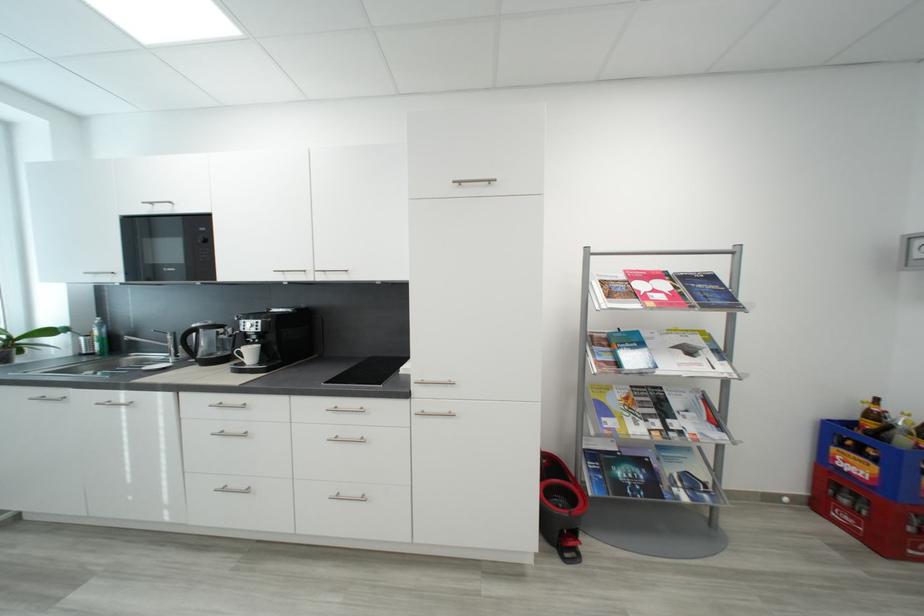
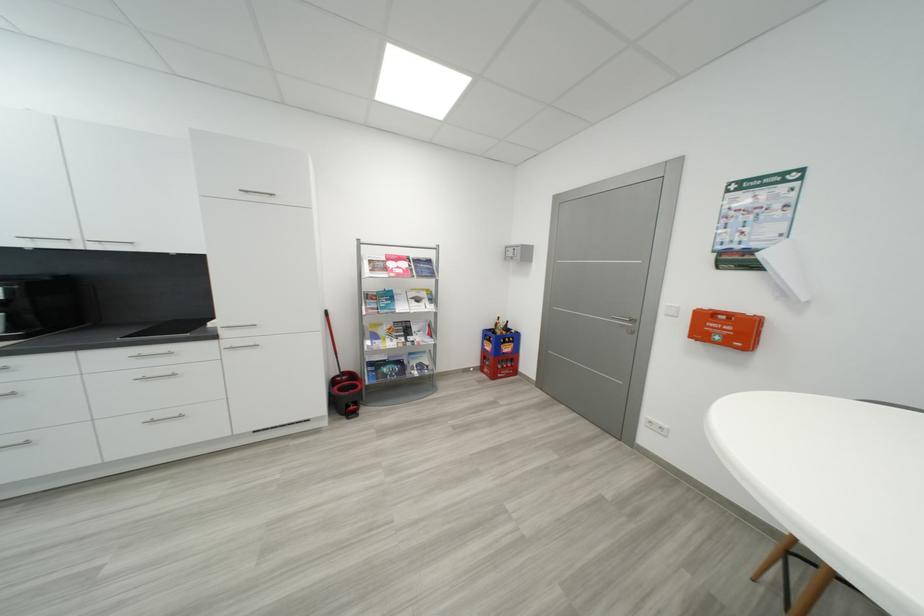
Locate, in the second image, the point that corresponds to pixel 640 296 in the first image.

(393, 270)